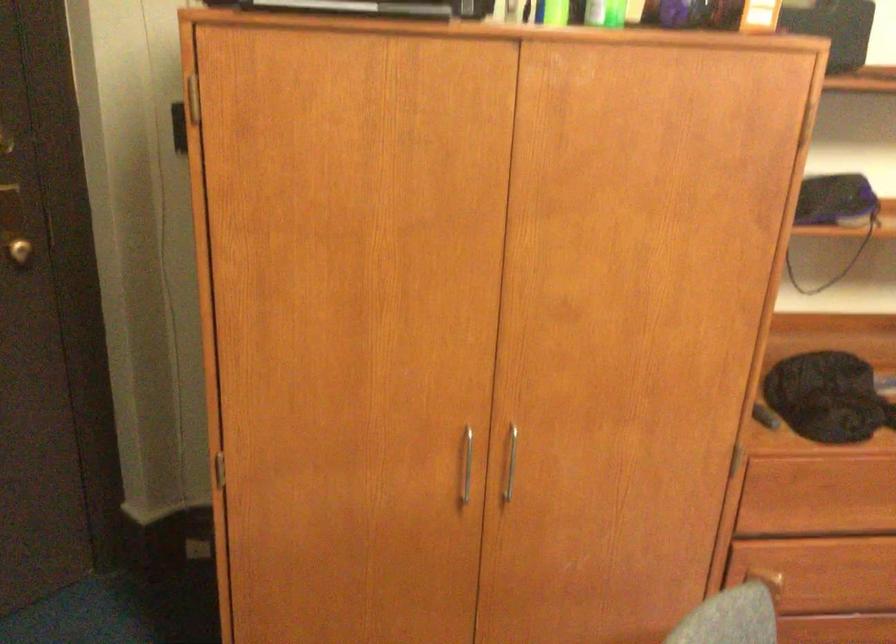
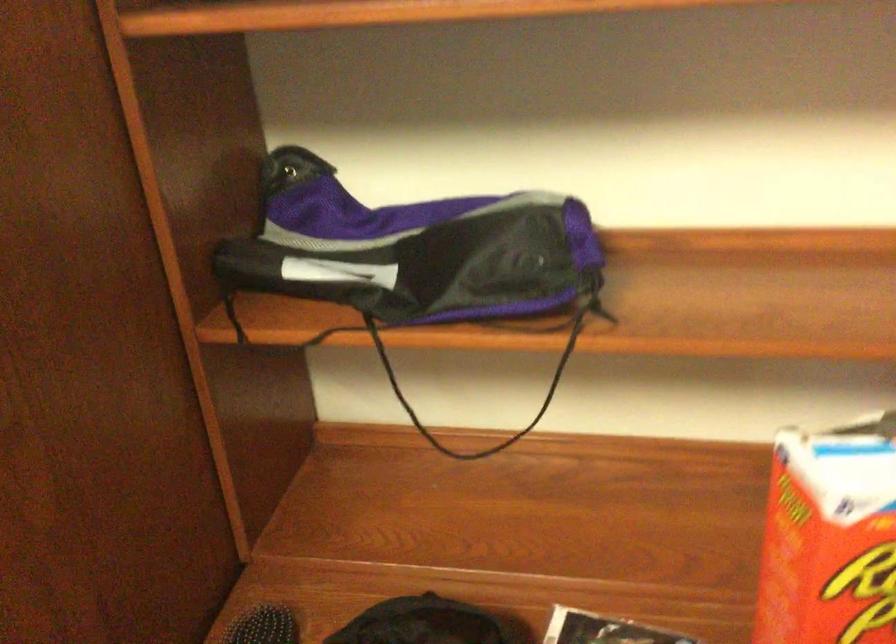
Which direction would the cameraman need to move to produce the second image?

The movement direction of the cameraman is right, forward.